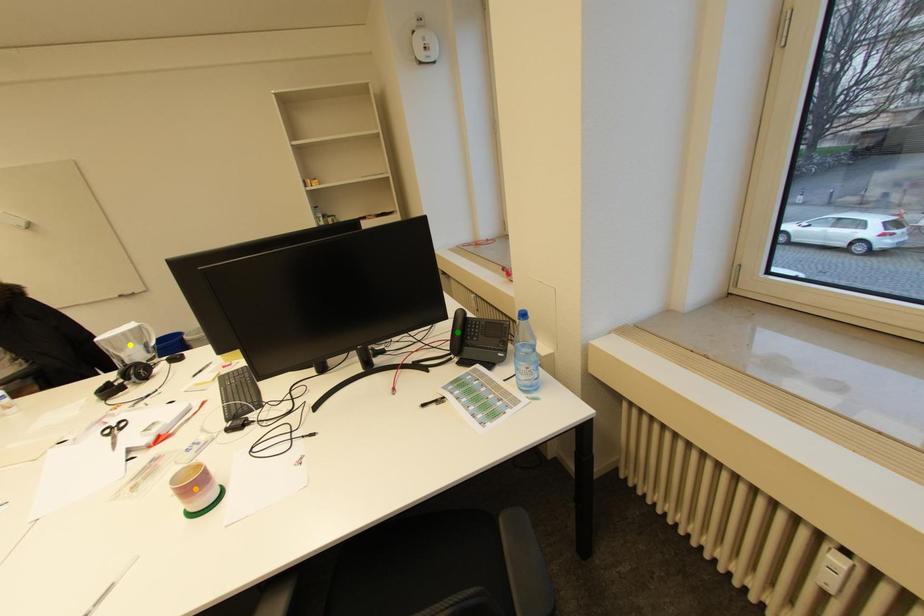
Order these from nearest to farthest:
A) orange point
B) yellow point
C) green point

1. orange point
2. green point
3. yellow point